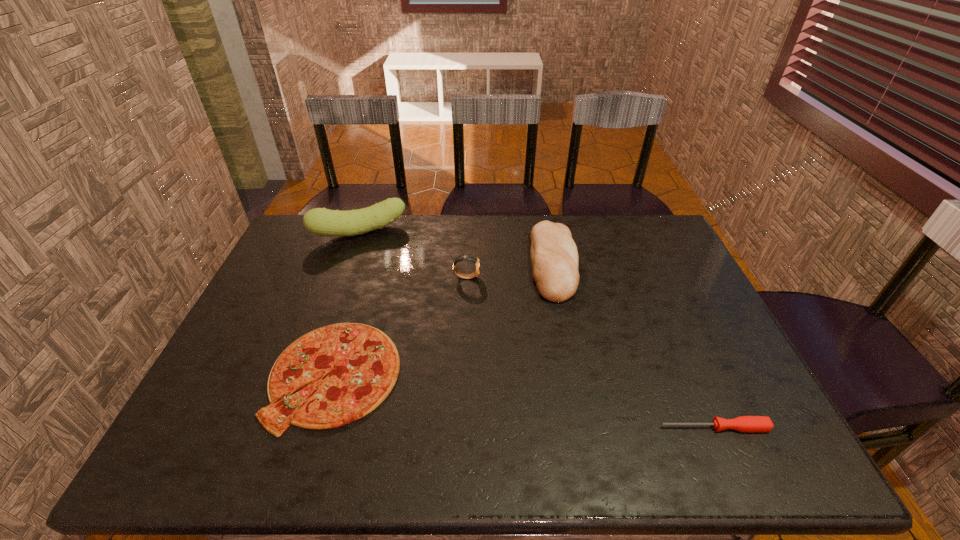
At what (x,y) coordinates should I click in order to perform the action: click on cucumber. Please return your answer as a coordinate pair (x, y). The height and width of the screenshot is (540, 960). Looking at the image, I should click on (320, 221).

I want to click on the fourth object from left to right, so click(554, 257).

The height and width of the screenshot is (540, 960). In order to click on the third object from right to left in this screenshot , I will do `click(472, 258)`.

This screenshot has width=960, height=540. What are the coordinates of `screwdriver` in the screenshot? It's located at (742, 423).

You are a GUI agent. You are given a task and a screenshot of the screen. Output one action in this format:
    pyautogui.click(x=<x>, y=<y>)
    Task: Click on the pizza
    
    Given the screenshot: What is the action you would take?
    pyautogui.click(x=362, y=363)

Locate an element on the screen. Image resolution: width=960 pixels, height=540 pixels. vacant position located on the front of the tallest object is located at coordinates (350, 260).

Locate an element on the screen. Image resolution: width=960 pixels, height=540 pixels. vacant position located on the front of the bread is located at coordinates (572, 362).

Identify the location of free space located 0.390m on the face of the third object from left to right. (606, 277).

This screenshot has width=960, height=540. What are the coordinates of `vacant space positioned 0.310m at the tip of the screwdriver` in the screenshot? It's located at click(x=521, y=428).

The height and width of the screenshot is (540, 960). What are the coordinates of `vacant region located at the tip of the screwdriver` in the screenshot? It's located at [x=503, y=428].